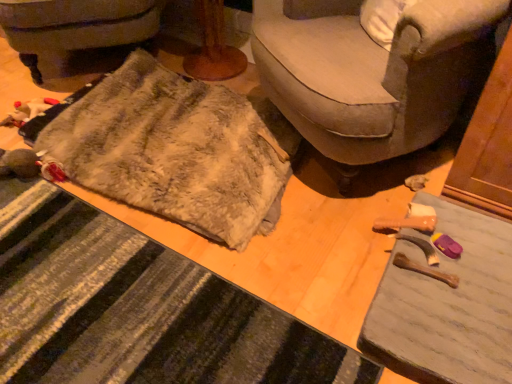
Question: From the image's perspective, does wooden table at lower right appear lower than soft beige fabric couch at center?

Choices:
 (A) no
 (B) yes

Answer: (B)

Question: Is wooden table at lower right positioned beyond the bounds of soft beige fabric couch at center?

Choices:
 (A) no
 (B) yes

Answer: (B)

Question: Does wooden table at lower right touch soft beige fabric couch at center?

Choices:
 (A) no
 (B) yes

Answer: (A)

Question: Does wooden table at lower right contain soft beige fabric couch at center?

Choices:
 (A) yes
 (B) no

Answer: (B)

Question: Are wooden table at lower right and soft beige fabric couch at center far apart?

Choices:
 (A) no
 (B) yes

Answer: (A)

Question: Can you confirm if wooden table at lower right is thinner than soft beige fabric couch at center?

Choices:
 (A) no
 (B) yes

Answer: (B)

Question: From the image's perspective, would you say soft beige fabric couch at center is shown under wooden table at lower right?

Choices:
 (A) no
 (B) yes

Answer: (A)

Question: Is wooden table at lower right inside soft beige fabric couch at center?

Choices:
 (A) no
 (B) yes

Answer: (A)

Question: From a real-world perspective, is soft beige fabric couch at center located beneath wooden table at lower right?

Choices:
 (A) yes
 (B) no

Answer: (B)

Question: Would you say soft beige fabric couch at center is outside wooden table at lower right?

Choices:
 (A) yes
 (B) no

Answer: (A)

Question: Does soft beige fabric couch at center have a larger size compared to wooden table at lower right?

Choices:
 (A) no
 (B) yes

Answer: (B)

Question: From the image's perspective, is soft beige fabric couch at center above wooden table at lower right?

Choices:
 (A) no
 (B) yes

Answer: (B)

Question: Does fuzzy fabric doormat at lower left have a lesser width compared to fuzzy fabric blanket at lower left?

Choices:
 (A) yes
 (B) no

Answer: (A)